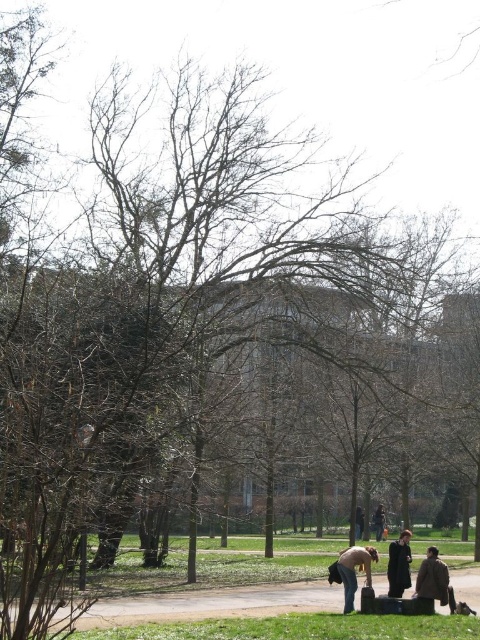
Question: Is green grass at lower center positioned in front of dark brown leather jacket at lower center?

Choices:
 (A) no
 (B) yes

Answer: (B)

Question: Considering the real-world distances, which object is farthest from the dark brown leather jacket at lower center?

Choices:
 (A) brown wool coat at lower right
 (B) green grass at lower center
 (C) brown leather jacket at lower center

Answer: (C)

Question: Which is farther from the brown wool coat at lower right?

Choices:
 (A) dark brown leather jacket at lower center
 (B) green grass at lower center
 (C) dark wool coat at lower right

Answer: (A)

Question: Among these points, which one is nearest to the camera?

Choices:
 (A) [408, 554]
 (B) [446, 570]

Answer: (B)

Question: Does green grass at lower center appear on the left side of brown wool coat at lower right?

Choices:
 (A) no
 (B) yes

Answer: (B)

Question: Is the position of brown wool coat at lower right more distant than that of dark brown leather jacket at lower center?

Choices:
 (A) yes
 (B) no

Answer: (B)